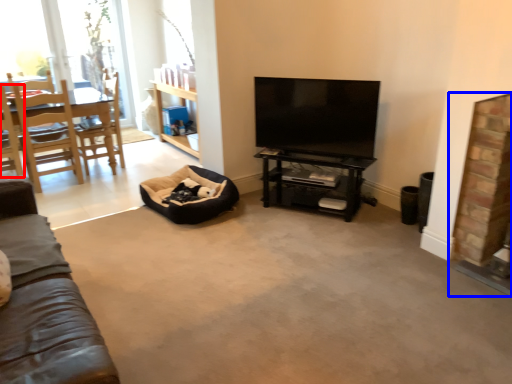
Question: Which object is closer to the camera taking this photo, chair (highlighted by a red box) or fireplace (highlighted by a blue box)?

Choices:
 (A) chair
 (B) fireplace

Answer: (B)